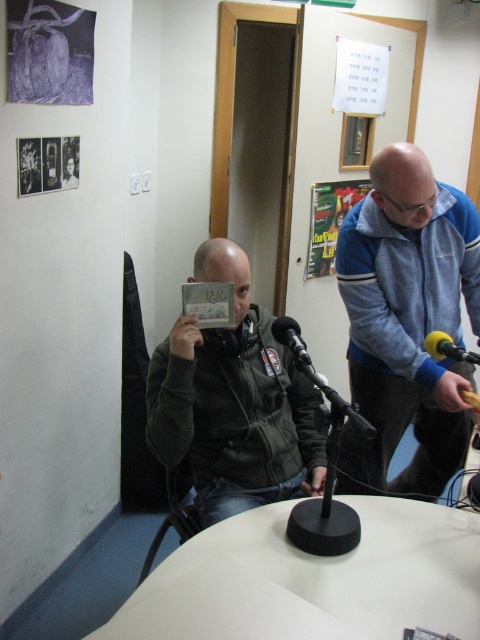
Who is positioned more to the left, dark gray jacket at center or yellow foam microphone at right?

dark gray jacket at center

Can you confirm if dark gray jacket at center is shorter than yellow foam microphone at right?

No, dark gray jacket at center is not shorter than yellow foam microphone at right.

Is point (192, 380) positioned after point (446, 349)?

Yes, point (192, 380) is behind point (446, 349).

Locate an element on the screen. The image size is (480, 640). dark gray jacket at center is located at coordinates (233, 404).

Between point (374, 387) and point (202, 346), which one is positioned in front?

Positioned in front is point (202, 346).

At what (x,y) coordinates should I click in order to perform the action: click on blue fleece jacket at upper right. Please return your answer as a coordinate pair (x, y). The width and height of the screenshot is (480, 640). Looking at the image, I should click on (407, 323).

Which is in front, point (420, 368) or point (274, 397)?

Positioned in front is point (420, 368).

Locate an element on the screen. The image size is (480, 640). blue fleece jacket at upper right is located at coordinates (407, 323).

Does blue fleece jacket at upper right have a greater height compared to black matte microphone at center?

Indeed, blue fleece jacket at upper right has a greater height compared to black matte microphone at center.

Can you confirm if blue fleece jacket at upper right is shorter than black matte microphone at center?

No.

At what (x,y) coordinates should I click in order to perform the action: click on blue fleece jacket at upper right. Please return your answer as a coordinate pair (x, y). The height and width of the screenshot is (640, 480). Looking at the image, I should click on (407, 323).